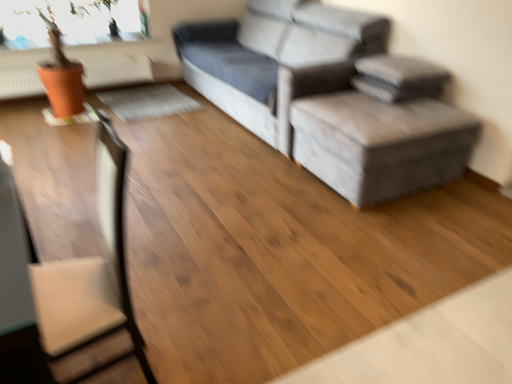
Find the location of `free spot behind brown leather swivel chair at left`. free spot behind brown leather swivel chair at left is located at coordinates (164, 299).